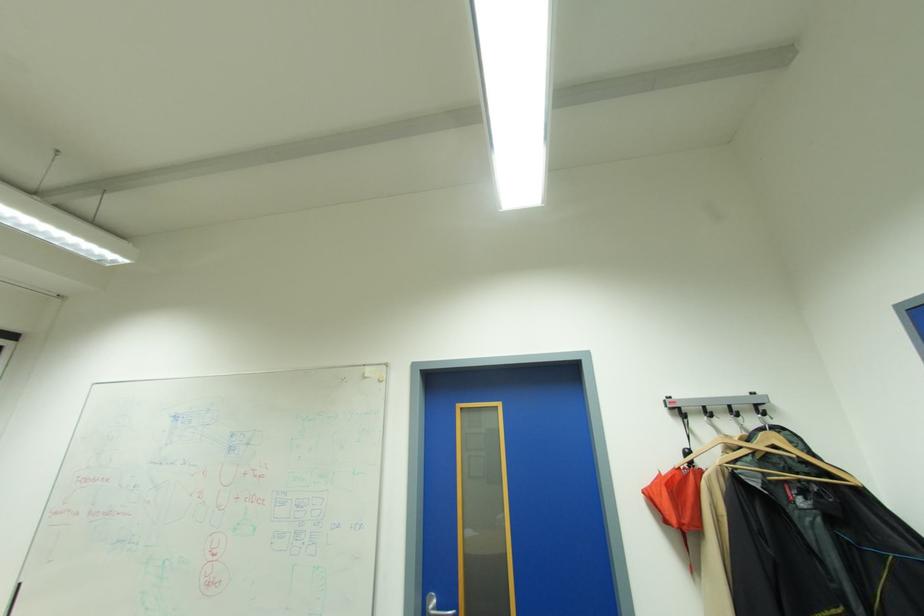
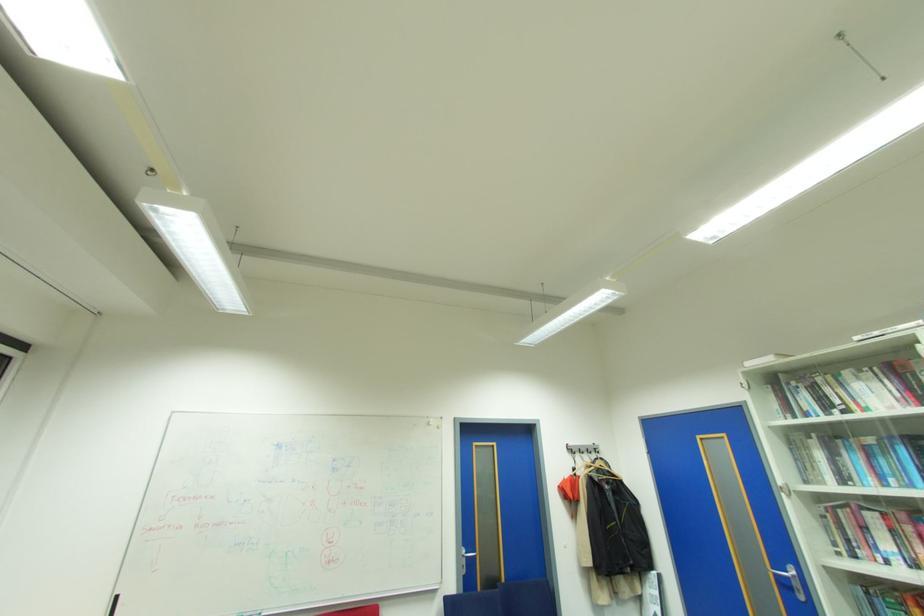
The point at (673,406) is marked in the first image. Where is the corresponding point in the second image?

(573, 448)